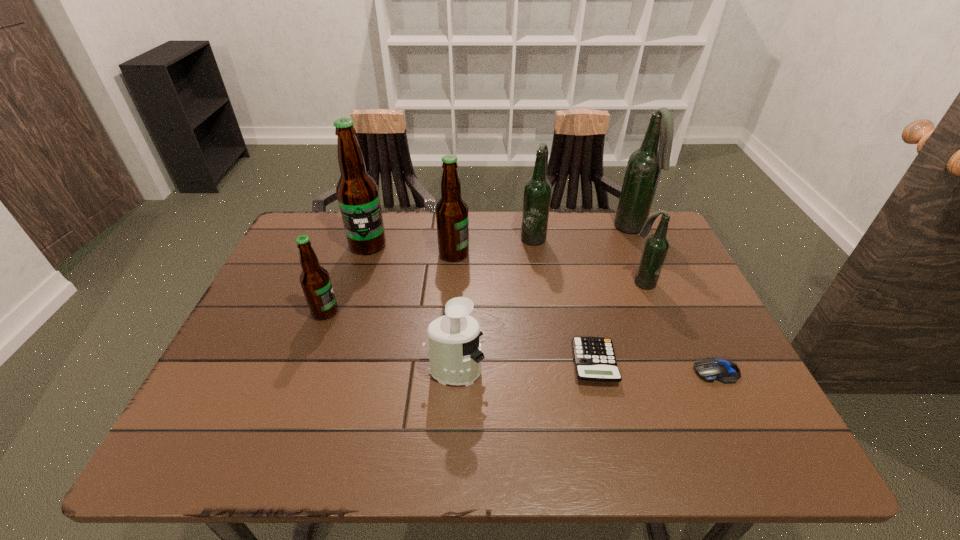
Locate an element on the screen. Image resolution: width=960 pixels, height=540 pixels. the biggest dark beer bottle is located at coordinates (644, 167).

Where is `the biggest brown beer bottle`? The image size is (960, 540). the biggest brown beer bottle is located at coordinates (357, 192).

I want to click on the second smallest dark beer bottle, so click(x=537, y=192).

This screenshot has height=540, width=960. In order to click on the third beer bottle from right to left in this screenshot , I will do `click(537, 192)`.

Where is `the rightmost brown beer bottle`? Image resolution: width=960 pixels, height=540 pixels. the rightmost brown beer bottle is located at coordinates (452, 220).

The height and width of the screenshot is (540, 960). I want to click on the second smallest brown beer bottle, so click(452, 220).

Find the location of `the sixth farthest object`. the sixth farthest object is located at coordinates (315, 281).

This screenshot has width=960, height=540. Find the location of `the nearest beer bottle`. the nearest beer bottle is located at coordinates (315, 281).

Find the location of a particular element. This screenshot has width=960, height=540. the nearest dark beer bottle is located at coordinates (656, 246).

What are the coordinates of `the smallest dark beer bottle` in the screenshot? It's located at (656, 246).